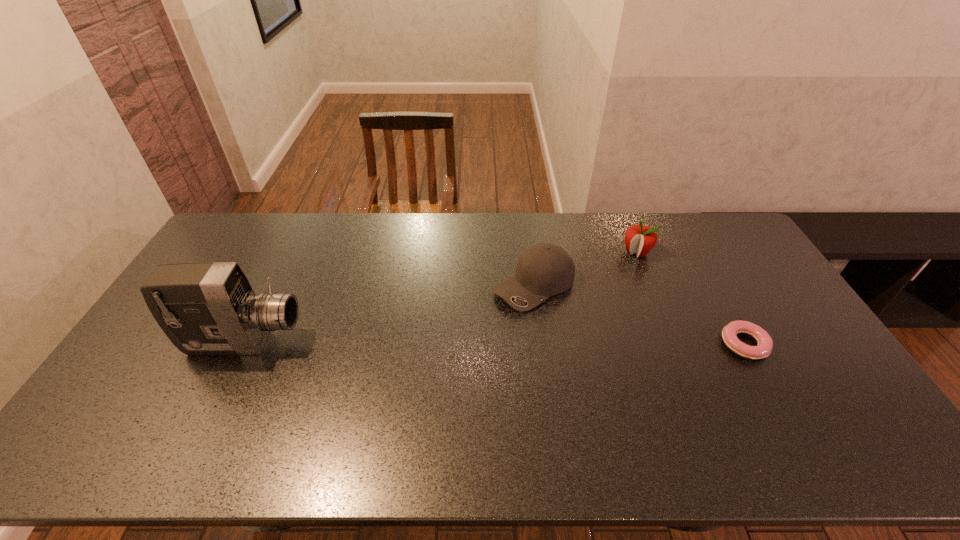
Where is `free area in between the doughnut and the baseball cap`? The image size is (960, 540). free area in between the doughnut and the baseball cap is located at coordinates (639, 315).

I want to click on object identified as the third closest to the baseball cap, so click(205, 308).

Find the location of a particular element. The image size is (960, 540). object that stands as the third closest to the apple is located at coordinates (205, 308).